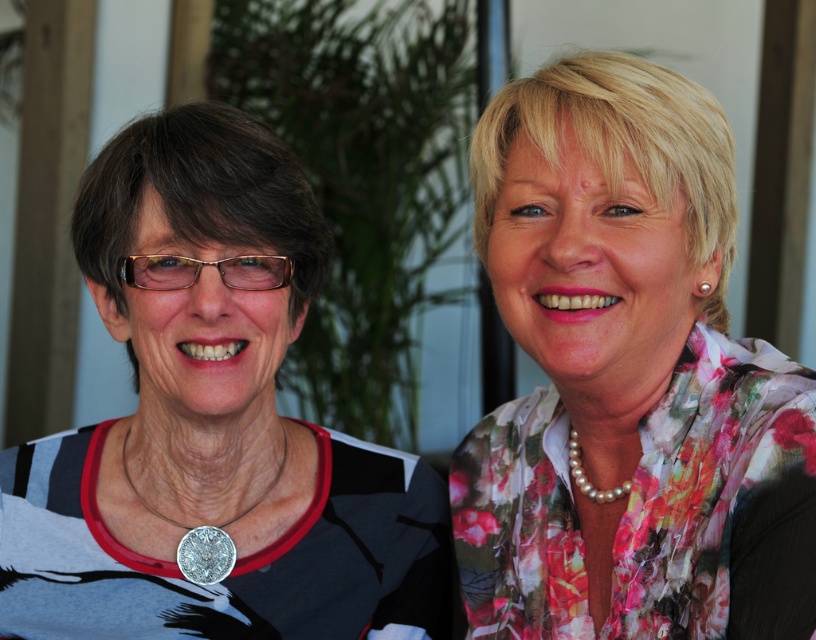
Question: Which of the following is the farthest from the observer?

Choices:
 (A) (185, 538)
 (B) (258, 324)

Answer: (A)

Question: Can you confirm if matte black shirt at left is positioned above silver metallic medal at lower left?

Choices:
 (A) no
 (B) yes

Answer: (B)

Question: Does floral fabric blouse at right have a lesser width compared to silver metallic medal at lower left?

Choices:
 (A) no
 (B) yes

Answer: (A)

Question: Can you confirm if floral fabric blouse at right is positioned to the left of silver metallic medal at lower left?

Choices:
 (A) no
 (B) yes

Answer: (A)

Question: Among these objects, which one is nearest to the camera?

Choices:
 (A) matte black shirt at left
 (B) floral fabric blouse at right

Answer: (B)

Question: Which point appears farthest from the camera in this image?

Choices:
 (A) (626, 628)
 (B) (197, 538)
 (C) (205, 292)

Answer: (B)